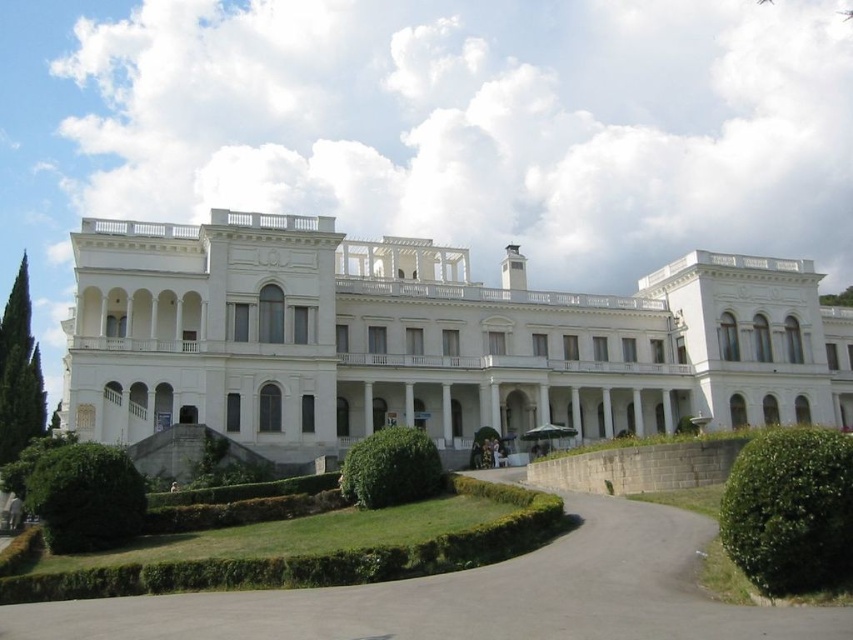
You are standing at the entrance of the white stone building at center. Where would you look to see the garden and pathway?

Since the white stone building at center is located at point [426,340], the garden and pathway are likely positioned in front of the building, which would be in the lower part of the image from your perspective.

You are standing in the garden and want to walk towards the entrance of the white stone building at center. There is a green leafy hedge at center in your path. Which direction should you go around the hedge to reach the building?

Since the white stone building at center is further to the viewer than the green leafy hedge at center, you should go around the hedge either to the left or right to reach the building.

Looking at this image, you are a gardener planning to trim the green leafy hedge at lower right and the green leafy hedge at center. Which hedge will require a ladder to reach the top?

The green leafy hedge at lower right is much taller than the green leafy hedge at center, so you will need a ladder to trim the green leafy hedge at lower right.